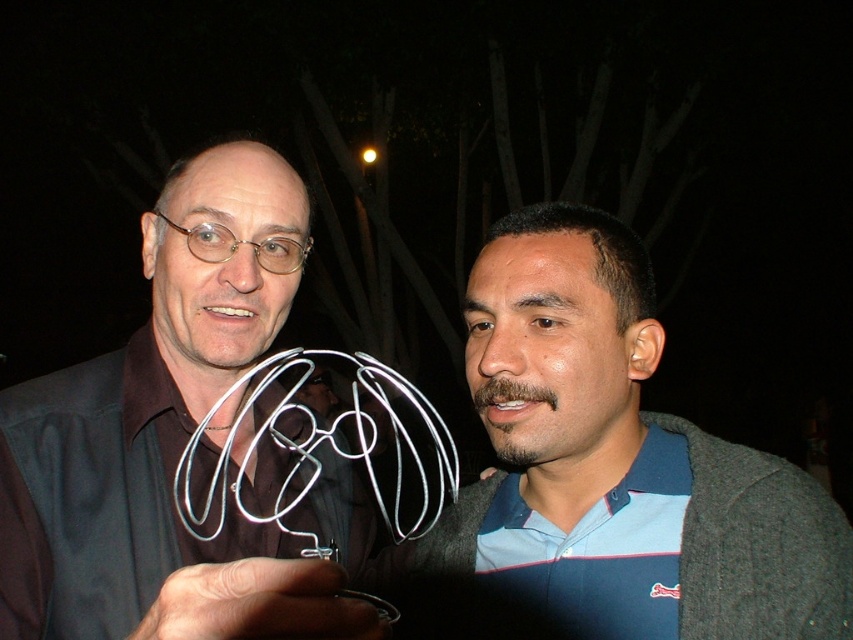
Is blue fabric shirt at center bigger than metallic wire sculpture at center?

Incorrect, blue fabric shirt at center is not larger than metallic wire sculpture at center.

Who is lower down, blue fabric shirt at center or metallic wire sculpture at center?

metallic wire sculpture at center

This screenshot has width=853, height=640. I want to click on blue fabric shirt at center, so click(619, 461).

The image size is (853, 640). I want to click on blue fabric shirt at center, so click(x=619, y=461).